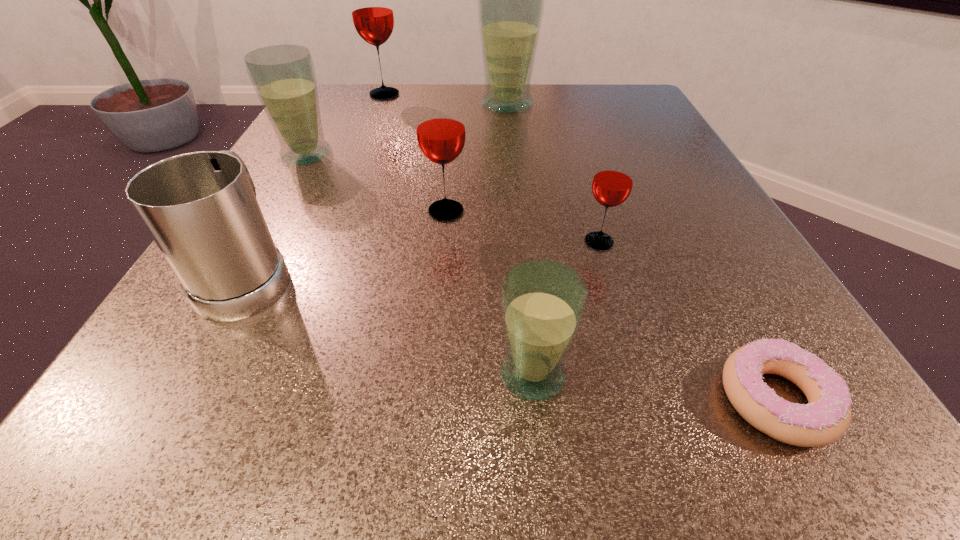
Find the location of a particular element. This screenshot has width=960, height=540. blank space at the far edge of the desktop is located at coordinates (499, 126).

Where is `free space at the near edge of the desktop`? The image size is (960, 540). free space at the near edge of the desktop is located at coordinates (x=608, y=387).

At what (x,y) coordinates should I click in order to perform the action: click on vacant space at the left edge of the desktop. Please return your answer as a coordinate pair (x, y). The height and width of the screenshot is (540, 960). Looking at the image, I should click on (283, 167).

Identify the location of vacant region at the right edge of the desktop. (696, 211).

Identify the location of free space at the far left corner. pos(369,86).

Find the location of a particular element. vacant space at the far right corner is located at coordinates (610, 84).

The height and width of the screenshot is (540, 960). I want to click on free point between the second red glass from left to right and the farthest red glass, so click(415, 153).

The width and height of the screenshot is (960, 540). Identify the location of vacant space in between the mug and the second farthest red glass. (348, 242).

Locate an element on the screen. The width and height of the screenshot is (960, 540). vacant area that lies between the rightmost object and the biggest blue glass is located at coordinates (641, 252).

Locate an element on the screen. This screenshot has width=960, height=540. free point between the shortest object and the second smallest red glass is located at coordinates (612, 305).